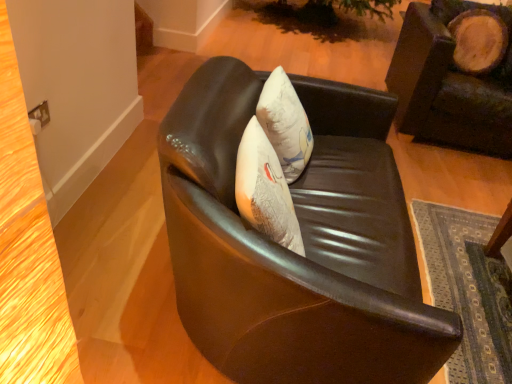
Question: Which is correct: shiny black leather chair at center, the second chair when ordered from right to left, is inside leather cushion at upper right, which appears as the first chair when viewed from the back, or outside of it?

Choices:
 (A) inside
 (B) outside

Answer: (B)

Question: From the image's perspective, relative to leather cushion at upper right, which is the first chair in right-to-left order, is shiny black leather chair at center, the 1th chair in the left-to-right sequence, above or below?

Choices:
 (A) above
 (B) below

Answer: (B)

Question: Would you say shiny black leather chair at center, which is counted as the second chair, starting from the back, is to the left or to the right of leather cushion at upper right, which appears as the first chair when viewed from the back, in the picture?

Choices:
 (A) right
 (B) left

Answer: (B)

Question: Looking at the image, does leather cushion at upper right, which appears as the first chair when viewed from the back, seem bigger or smaller compared to shiny black leather chair at center, acting as the first chair starting from the front?

Choices:
 (A) big
 (B) small

Answer: (B)

Question: Based on their positions, is leather cushion at upper right, which is counted as the second chair, starting from the left, located to the left or right of shiny black leather chair at center, acting as the first chair starting from the front?

Choices:
 (A) right
 (B) left

Answer: (A)

Question: From the image's perspective, is leather cushion at upper right, arranged as the 2th chair when viewed from the front, located above or below shiny black leather chair at center, which is counted as the second chair, starting from the back?

Choices:
 (A) below
 (B) above

Answer: (B)

Question: From a real-world perspective, is leather cushion at upper right, arranged as the 2th chair when viewed from the front, above or below shiny black leather chair at center, the 1th chair in the left-to-right sequence?

Choices:
 (A) above
 (B) below

Answer: (A)